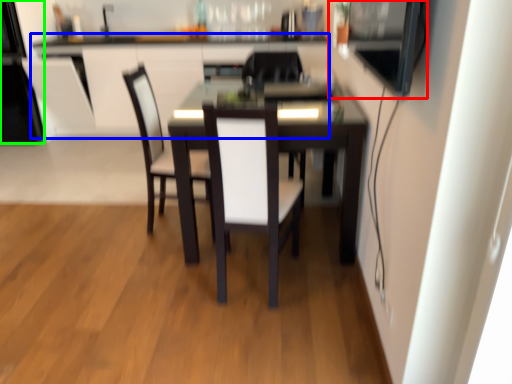
Question: Based on their relative distances, which object is farther from appliance (highlighted by a red box)? Choose from computer desk (highlighted by a blue box) and appliance (highlighted by a green box).

Choices:
 (A) computer desk
 (B) appliance

Answer: (B)